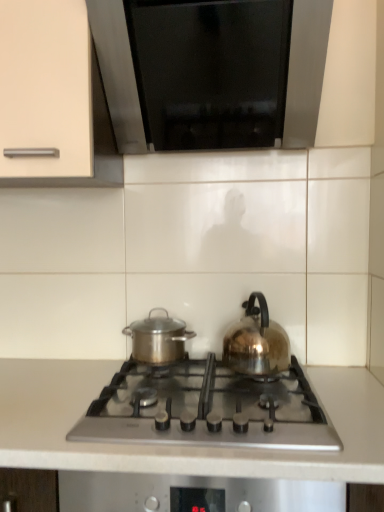
Where is `empty space that is ontop of white matte countertop at center (from a real-world perspective)`? This screenshot has height=512, width=384. empty space that is ontop of white matte countertop at center (from a real-world perspective) is located at coordinates (153, 407).